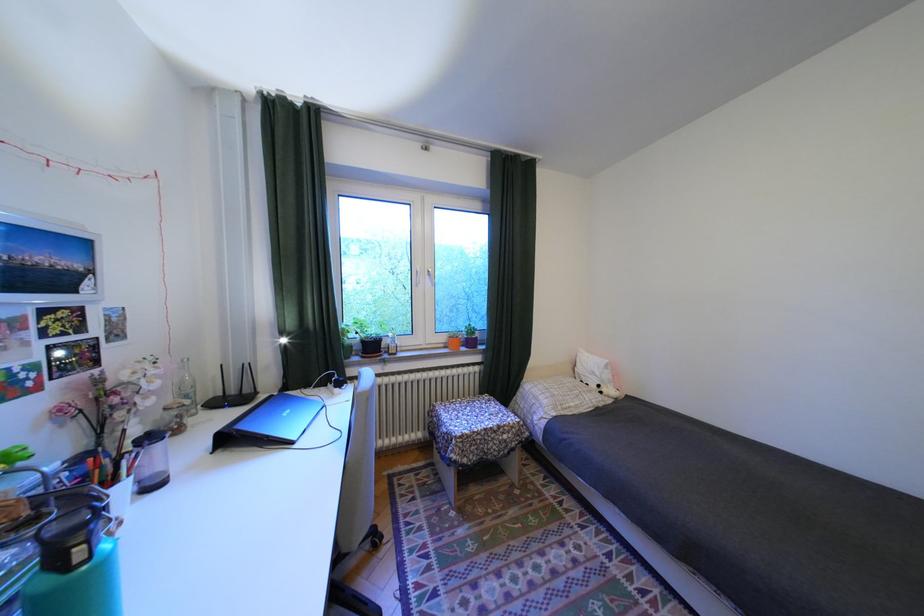
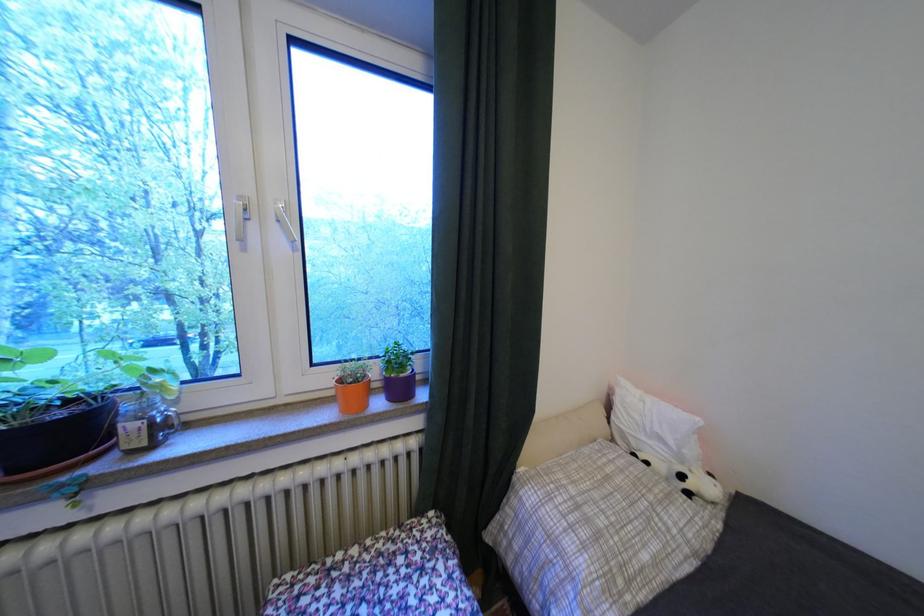
Find the pixel in the second image that matches [589,407] in the first image.

(667, 562)